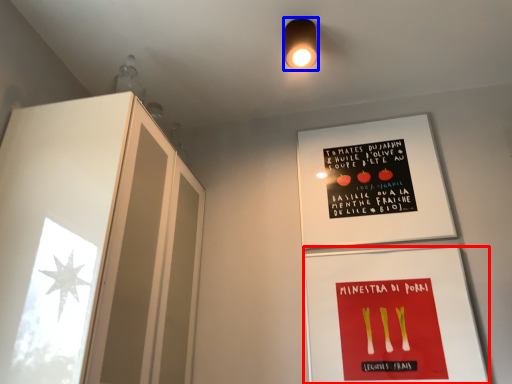
Question: Which object is closer to the camera taking this photo, flyer (highlighted by a red box) or light fixture (highlighted by a blue box)?

Choices:
 (A) flyer
 (B) light fixture

Answer: (A)